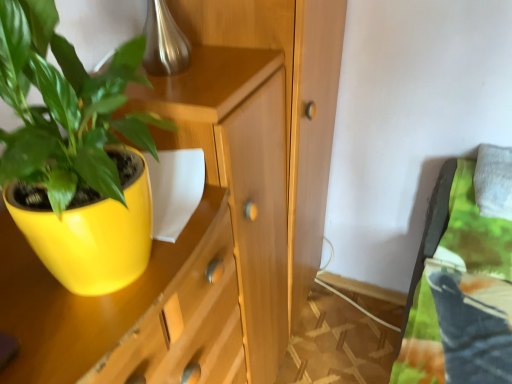
Question: From a real-world perspective, is wooden dresser at center positioned under matte yellow pot at left based on gravity?

Choices:
 (A) no
 (B) yes

Answer: (B)

Question: From a real-world perspective, is wooden dresser at center physically above matte yellow pot at left?

Choices:
 (A) yes
 (B) no

Answer: (B)

Question: Considering the relative sizes of wooden dresser at center and matte yellow pot at left in the image provided, is wooden dresser at center wider than matte yellow pot at left?

Choices:
 (A) no
 (B) yes

Answer: (B)

Question: Does wooden dresser at center appear on the left side of matte yellow pot at left?

Choices:
 (A) no
 (B) yes

Answer: (A)

Question: Is wooden dresser at center thinner than matte yellow pot at left?

Choices:
 (A) no
 (B) yes

Answer: (A)

Question: Does wooden dresser at center appear on the right side of matte yellow pot at left?

Choices:
 (A) no
 (B) yes

Answer: (B)

Question: From a real-world perspective, is matte wood cabinet at center below matte yellow pot at left?

Choices:
 (A) no
 (B) yes

Answer: (B)

Question: Is matte wood cabinet at center positioned before matte yellow pot at left?

Choices:
 (A) yes
 (B) no

Answer: (B)

Question: Can you see matte wood cabinet at center touching matte yellow pot at left?

Choices:
 (A) no
 (B) yes

Answer: (A)

Question: Does matte wood cabinet at center have a lesser width compared to matte yellow pot at left?

Choices:
 (A) yes
 (B) no

Answer: (B)

Question: Is matte wood cabinet at center smaller than matte yellow pot at left?

Choices:
 (A) yes
 (B) no

Answer: (B)

Question: Can we say matte wood cabinet at center lies outside matte yellow pot at left?

Choices:
 (A) no
 (B) yes

Answer: (B)

Question: From the image's perspective, is white fabric pillow at upper right over wooden dresser at center?

Choices:
 (A) yes
 (B) no

Answer: (A)